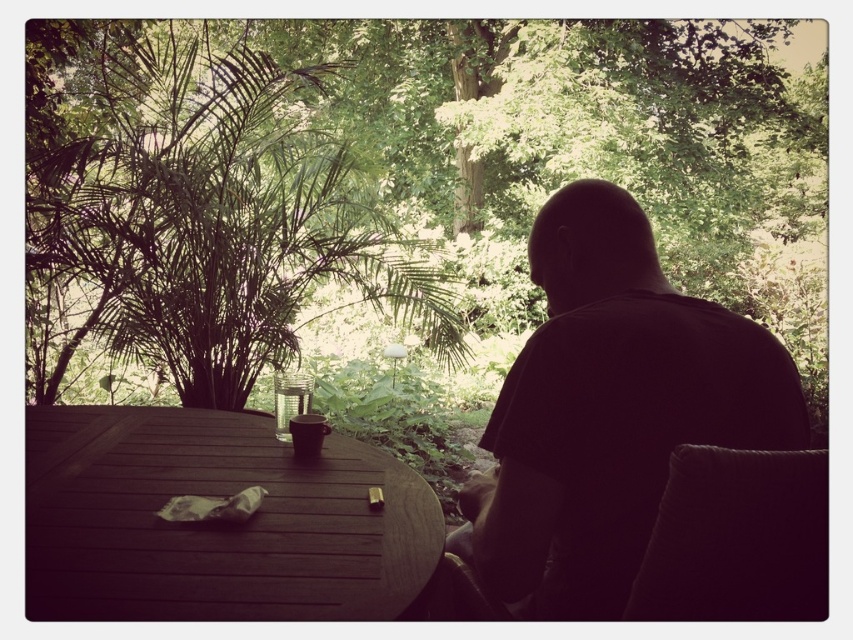
You are planning to place a decorative item on the clear glass cup at center. Considering the size of the green leafy tree at upper center, do you think the decorative item will fit on the cup without exceeding its width?

The green leafy tree at upper center is wider than the clear glass cup at center. Since the decorative item would need to be smaller than the cup to fit, and the tree is wider, the decorative item might not exceed the cup if it is smaller than the cup itself. However, the tree width comparison doesn